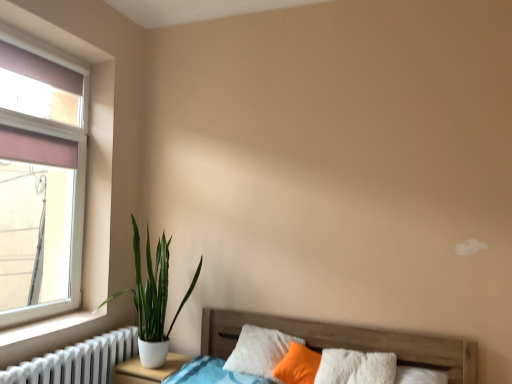
Question: Is transparent glass window at left positioned far away from white matte nightstand at lower left?

Choices:
 (A) no
 (B) yes

Answer: (B)

Question: Would you say transparent glass window at left is outside white matte nightstand at lower left?

Choices:
 (A) no
 (B) yes

Answer: (B)

Question: Is transparent glass window at left positioned with its back to white matte nightstand at lower left?

Choices:
 (A) no
 (B) yes

Answer: (A)

Question: Considering the relative sizes of transparent glass window at left and white matte nightstand at lower left in the image provided, is transparent glass window at left wider than white matte nightstand at lower left?

Choices:
 (A) yes
 (B) no

Answer: (B)

Question: Is transparent glass window at left shorter than white matte nightstand at lower left?

Choices:
 (A) yes
 (B) no

Answer: (B)

Question: Considering the relative sizes of transparent glass window at left and white matte nightstand at lower left in the image provided, is transparent glass window at left taller than white matte nightstand at lower left?

Choices:
 (A) no
 (B) yes

Answer: (B)

Question: Considering the relative sizes of white matte nightstand at lower left and white ceramic plant at left in the image provided, is white matte nightstand at lower left bigger than white ceramic plant at left?

Choices:
 (A) yes
 (B) no

Answer: (B)

Question: Does white matte nightstand at lower left lie in front of white ceramic plant at left?

Choices:
 (A) no
 (B) yes

Answer: (A)

Question: Does white matte nightstand at lower left have a greater height compared to white ceramic plant at left?

Choices:
 (A) no
 (B) yes

Answer: (A)

Question: From the image's perspective, is white matte nightstand at lower left under white ceramic plant at left?

Choices:
 (A) yes
 (B) no

Answer: (A)

Question: Does white matte nightstand at lower left have a lesser height compared to white ceramic plant at left?

Choices:
 (A) yes
 (B) no

Answer: (A)

Question: Considering the relative positions of white matte nightstand at lower left and white ceramic plant at left in the image provided, is white matte nightstand at lower left to the right of white ceramic plant at left from the viewer's perspective?

Choices:
 (A) yes
 (B) no

Answer: (B)

Question: Is white metallic radiator at lower left next to white matte nightstand at lower left and touching it?

Choices:
 (A) yes
 (B) no

Answer: (B)